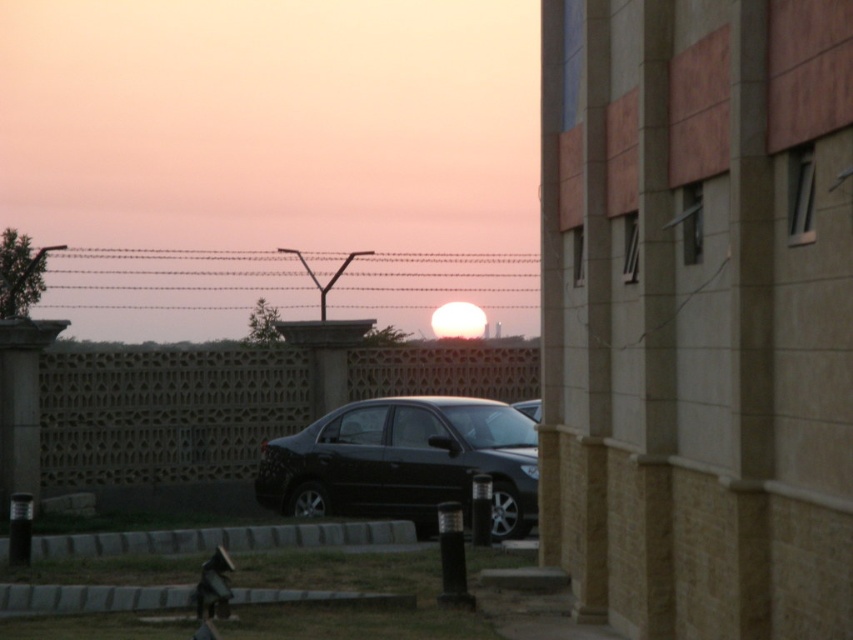
Between light brown textured wall at center and glossy black car at center, which one has more height?

With more height is glossy black car at center.

Between point (154, 355) and point (508, 438), which one is positioned in front?

Point (508, 438)

At what (x,y) coordinates should I click in order to perform the action: click on light brown textured wall at center. Please return your answer as a coordinate pair (x, y). Looking at the image, I should click on (167, 412).